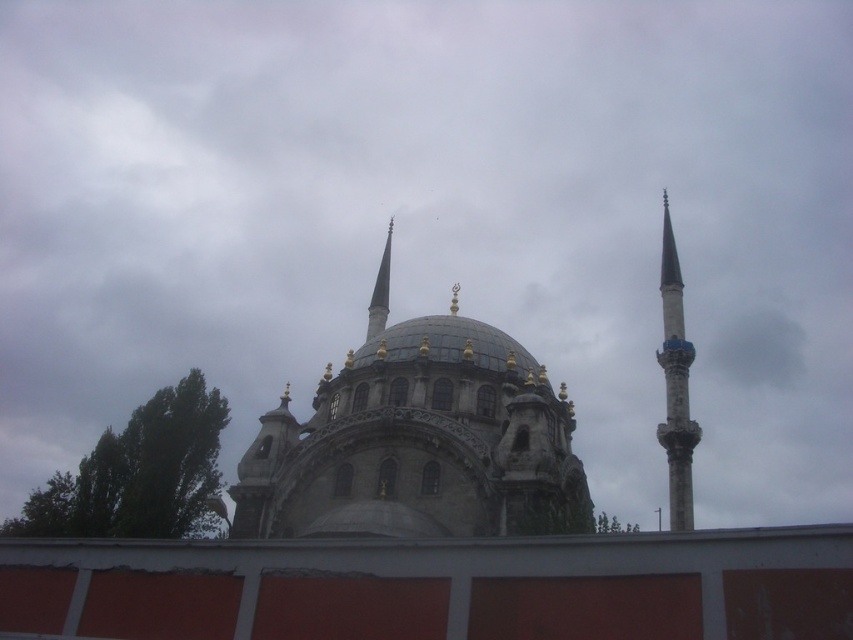
The height and width of the screenshot is (640, 853). What are the coordinates of `blue stone dome at center` in the screenshot? It's located at (418, 444).

Is blue glossy minaret at right above smooth white spire at center?

Incorrect, blue glossy minaret at right is not positioned above smooth white spire at center.

Who is lower down, blue glossy minaret at right or smooth white spire at center?

Positioned lower is blue glossy minaret at right.

Identify the location of blue glossy minaret at right. (675, 385).

Identify the location of blue glossy minaret at right. This screenshot has width=853, height=640. (675, 385).

Who is more forward, (248, 464) or (698, 433)?

Point (248, 464)

Can you confirm if blue stone dome at center is positioned to the left of blue glossy minaret at right?

Indeed, blue stone dome at center is positioned on the left side of blue glossy minaret at right.

Where is `blue stone dome at center`? This screenshot has width=853, height=640. blue stone dome at center is located at coordinates (418, 444).